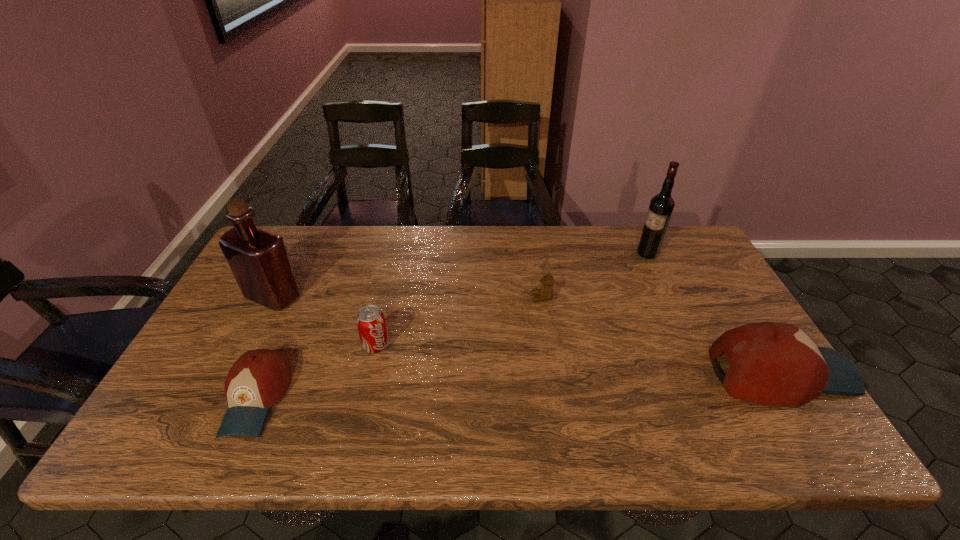
Where is `free region located 0.120m on the front-facing side of the teddy bear`? free region located 0.120m on the front-facing side of the teddy bear is located at coordinates (492, 298).

Identify the location of vacant area situated on the front and back of the wine bottle. (591, 253).

You are a GUI agent. You are given a task and a screenshot of the screen. Output one action in this format:
    pyautogui.click(x=<x>, y=<y>)
    Task: Click on the vacant area situated on the front and back of the wine bottle
    The width and height of the screenshot is (960, 540).
    Given the screenshot: What is the action you would take?
    pyautogui.click(x=591, y=253)

Identify the location of free space located on the front and back of the wine bottle. The image size is (960, 540). [555, 253].

Where is `vacant space located 0.230m on the right of the liquor`? The height and width of the screenshot is (540, 960). vacant space located 0.230m on the right of the liquor is located at coordinates (380, 296).

Where is `free space located on the back of the soda`? This screenshot has height=540, width=960. free space located on the back of the soda is located at coordinates (394, 271).

This screenshot has width=960, height=540. I want to click on object located at the far edge, so click(661, 207).

Find the location of `baseball cap at the left edge`. baseball cap at the left edge is located at coordinates (259, 378).

At what (x,y) coordinates should I click in order to perform the action: click on liquor present at the left edge. Please return your answer as a coordinate pair (x, y). Looking at the image, I should click on (259, 260).

Find the location of a particular element. The height and width of the screenshot is (540, 960). baseball cap that is at the right edge is located at coordinates (775, 364).